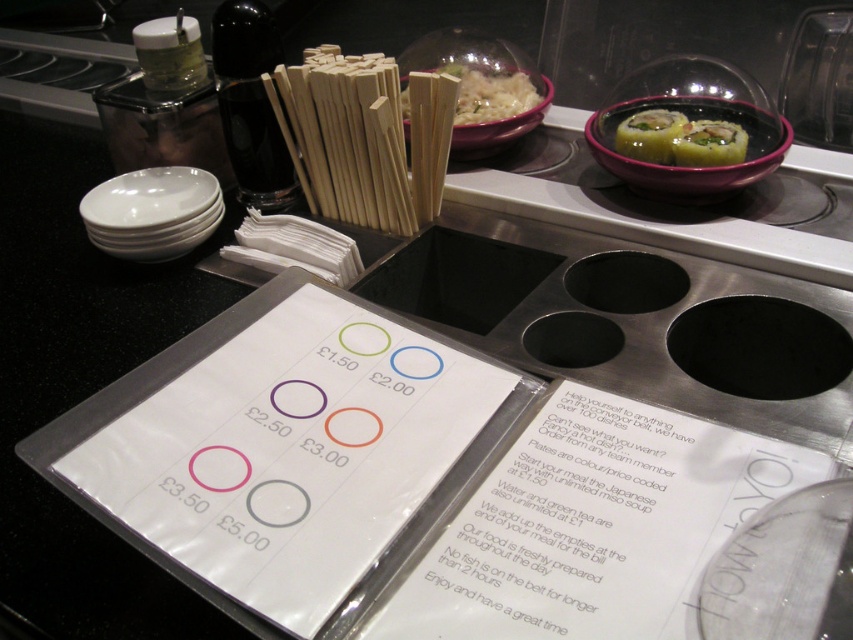
Question: Which of the following is the closest to the observer?

Choices:
 (A) wooden chopsticks at center
 (B) purple glossy bowl at upper right
 (C) green leafy sushi at upper right
 (D) white paper menu at center

Answer: (D)

Question: Can you confirm if white glossy bowl at left is positioned to the left of green matte sushi at upper right?

Choices:
 (A) yes
 (B) no

Answer: (A)

Question: Can you confirm if white glossy bowl at left is positioned below green leafy sushi at upper right?

Choices:
 (A) yes
 (B) no

Answer: (A)

Question: Estimate the real-world distances between objects in this image. Which object is closer to the white paper menu at center?

Choices:
 (A) wooden chopsticks at center
 (B) white matte rice at center

Answer: (A)

Question: Considering the real-world distances, which object is closest to the white paper menu at center?

Choices:
 (A) white plastic menu at center
 (B) wooden chopsticks at center

Answer: (A)

Question: Is white paper menu at center further to camera compared to purple glossy bowl at upper right?

Choices:
 (A) no
 (B) yes

Answer: (A)